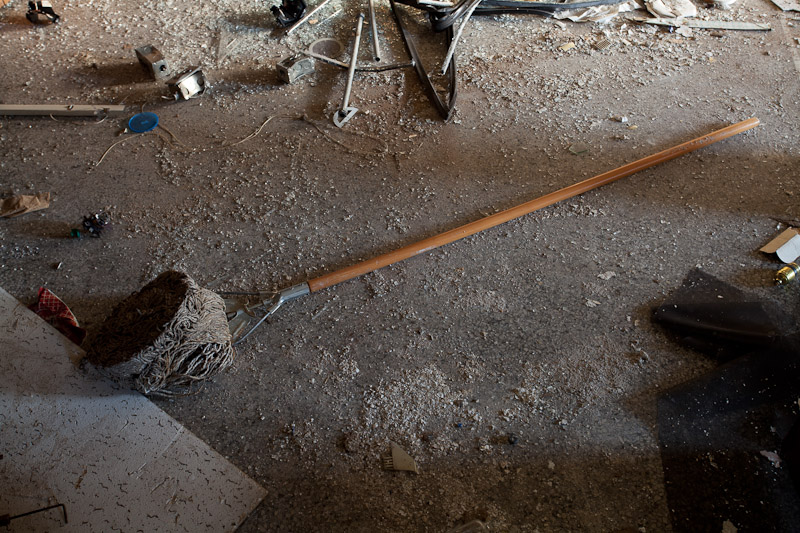
I want to click on light bulb, so click(x=784, y=276).